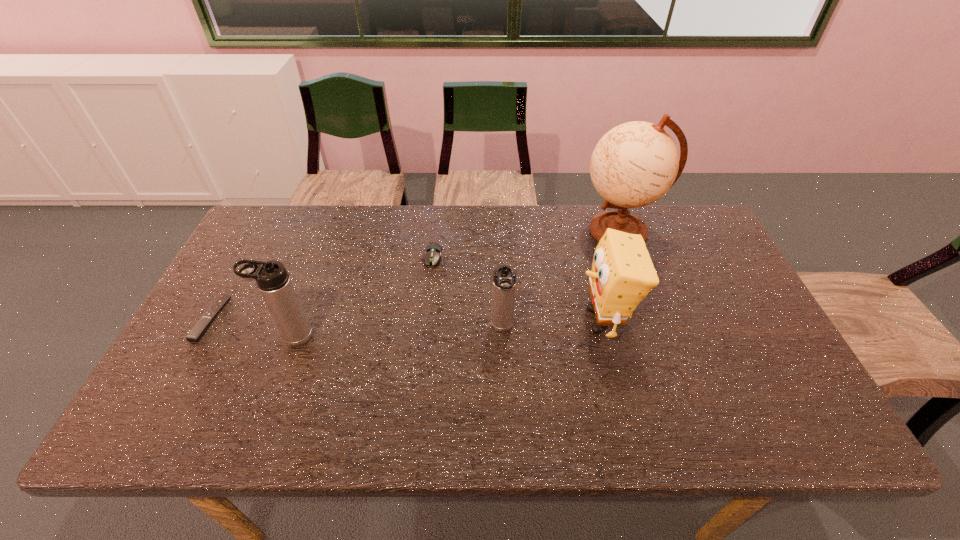
Locate an element on the screen. free space located on the face of the sponge is located at coordinates (534, 320).

Where is `free spot located on the face of the sponge`? Image resolution: width=960 pixels, height=540 pixels. free spot located on the face of the sponge is located at coordinates (515, 320).

Image resolution: width=960 pixels, height=540 pixels. I want to click on globe positioned at the far edge, so click(634, 164).

This screenshot has width=960, height=540. I want to click on computer mouse at the far edge, so click(x=433, y=253).

Locate an element on the screen. The image size is (960, 540). object at the left edge is located at coordinates (200, 328).

Locate an element on the screen. This screenshot has height=540, width=960. object situated at the right edge is located at coordinates (634, 164).

Where is `object located at the far right corner`? This screenshot has height=540, width=960. object located at the far right corner is located at coordinates (634, 164).

Where is `vacant space at the far edge of the desktop`? The height and width of the screenshot is (540, 960). vacant space at the far edge of the desktop is located at coordinates (532, 218).

I want to click on free space at the near edge of the desktop, so click(551, 394).

Image resolution: width=960 pixels, height=540 pixels. In the image, there is a desktop. What are the coordinates of `free space at the left edge` in the screenshot? It's located at [239, 311].